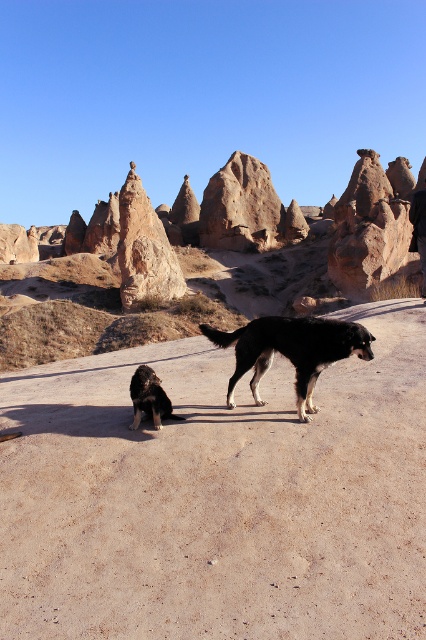
Question: In this image, where is brown sandy dirt track at center located relative to coral sandstone rock formation at upper center?

Choices:
 (A) right
 (B) left

Answer: (B)

Question: Which of the following is the closest to the observer?

Choices:
 (A) (164, 532)
 (B) (422, 234)

Answer: (A)

Question: Observing the image, what is the correct spatial positioning of black fur dog at lower left in reference to black leather pants at center?

Choices:
 (A) above
 (B) below

Answer: (B)

Question: Which point is farther from the camera taking this photo?

Choices:
 (A) (140, 408)
 (B) (0, 497)
 (C) (417, 205)
 (D) (344, 336)

Answer: (C)

Question: Is black fur dog at lower left below black leather pants at center?

Choices:
 (A) no
 (B) yes

Answer: (B)

Question: Estimate the real-world distances between objects in this image. Which object is closer to the brown sandy dirt track at center?

Choices:
 (A) black fur dog at lower left
 (B) black leather pants at center
 (C) black fur dog at center

Answer: (C)